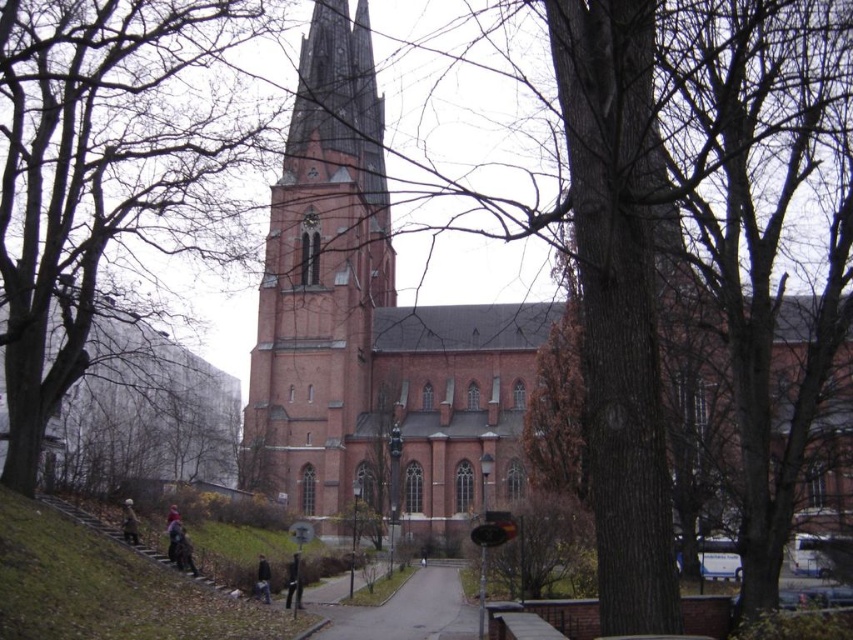
Does black leather jacket at lower center have a greater width compared to dark blue jacket at lower center?

Yes.

Between point (294, 561) and point (259, 561), which one is positioned in front?

Point (294, 561)

Identify the location of black leather jacket at lower center. (293, 582).

Does red brick church tower at center have a lesser height compared to gray asphalt path at center?

No, red brick church tower at center is not shorter than gray asphalt path at center.

Can you confirm if red brick church tower at center is positioned to the left of gray asphalt path at center?

Indeed, red brick church tower at center is positioned on the left side of gray asphalt path at center.

Is point (358, 282) farther from camera compared to point (434, 627)?

That is True.

In order to click on red brick church tower at center in this screenshot , I will do `click(322, 276)`.

Consider the image. Between red brick church at center and dark brown leather jacket at lower center, which one is positioned higher?

red brick church at center is higher up.

Can you confirm if red brick church at center is shorter than dark brown leather jacket at lower center?

No.

Where is `red brick church at center`? This screenshot has height=640, width=853. red brick church at center is located at coordinates (370, 326).